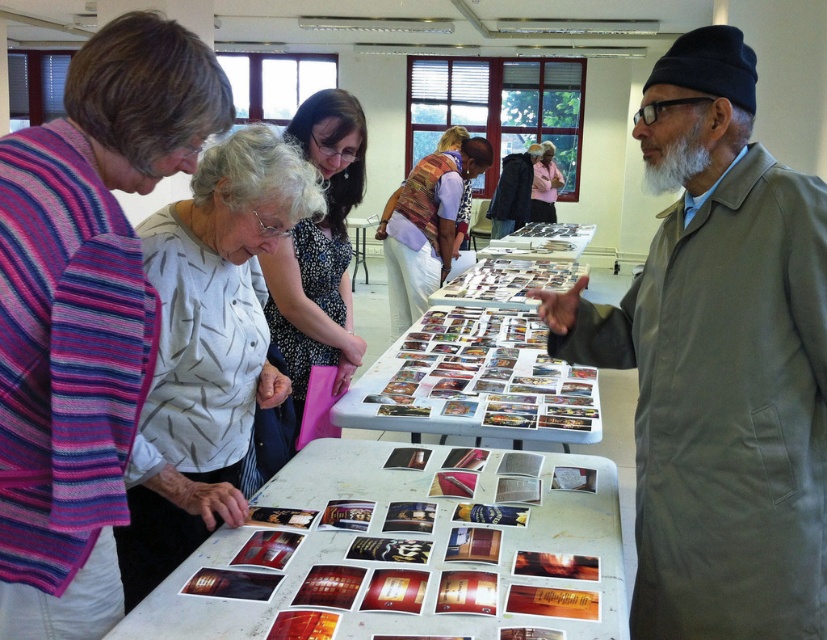
You are an organizer at the event and need to move the gray matte coat at right and the patterned fabric vest at center to a display table. Which object should you move first to avoid blocking the view of the other?

You should move the gray matte coat at right first because it is positioned under the patterned fabric vest at center, so moving it first will prevent blocking the view of the vest.